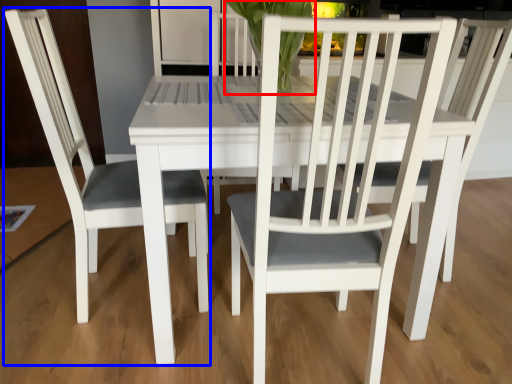
Question: Which object is closer to the camera taking this photo, orchid (highlighted by a red box) or chair (highlighted by a blue box)?

Choices:
 (A) orchid
 (B) chair

Answer: (B)